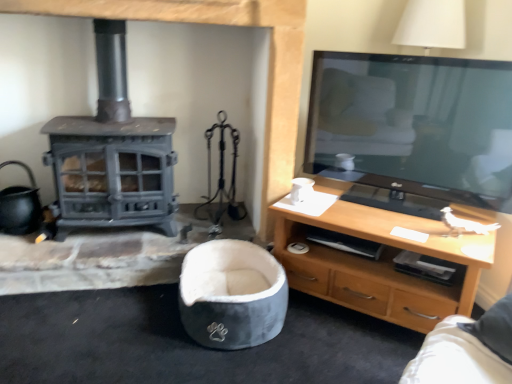
The image size is (512, 384). What are the coordinates of `free space between light wood/finish tv stand at right and velvet grey bean bag chair at center` in the screenshot? It's located at (323, 342).